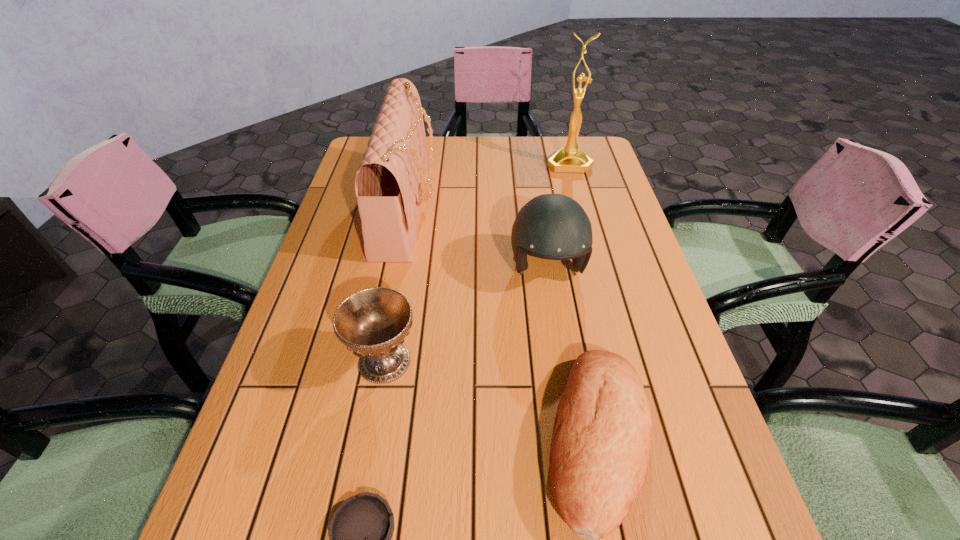
I want to click on handbag located in the left edge section of the desktop, so click(x=390, y=182).

Locate an element on the screen. chalice present at the left edge is located at coordinates (373, 322).

You are a GUI agent. You are given a task and a screenshot of the screen. Output one action in this format:
    pyautogui.click(x=<x>, y=<y>)
    Task: Click on the award located in the right edge section of the desktop
    The width and height of the screenshot is (960, 540).
    Given the screenshot: What is the action you would take?
    pyautogui.click(x=569, y=158)

This screenshot has width=960, height=540. I want to click on football helmet that is at the right edge, so click(x=553, y=226).

Where is `object that is at the far left corner`? object that is at the far left corner is located at coordinates (390, 182).

Locate an element on the screen. object that is at the far right corner is located at coordinates (569, 158).

You are a GUI agent. You are given a task and a screenshot of the screen. Output one action in this format:
    pyautogui.click(x=<x>, y=<y>)
    Task: Click on the vacant space at the far edge of the desktop
    
    Given the screenshot: What is the action you would take?
    pyautogui.click(x=489, y=137)

In the image, there is a desktop. Where is `vacant space at the left edge`? The height and width of the screenshot is (540, 960). vacant space at the left edge is located at coordinates (320, 259).

Where is `vacant region at the right edge of the desktop`? vacant region at the right edge of the desktop is located at coordinates (607, 312).

Image resolution: width=960 pixels, height=540 pixels. In order to click on empty space that is in between the award and the fifth shortest object in this screenshot , I will do `click(489, 186)`.